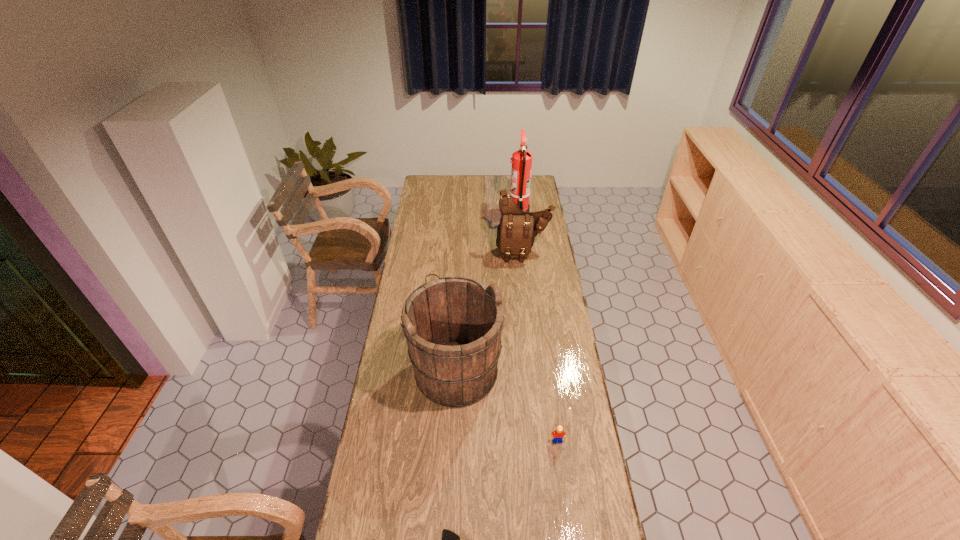
I want to click on vacant space at the right edge of the desktop, so click(539, 347).

Locate an element on the screen. The width and height of the screenshot is (960, 540). vacant region at the far right corner of the desktop is located at coordinates (541, 191).

Find the location of `vacant space that is in between the fourth farthest object and the second farthest object`. vacant space that is in between the fourth farthest object and the second farthest object is located at coordinates (540, 347).

You are a GUI agent. You are given a task and a screenshot of the screen. Output one action in this format:
    pyautogui.click(x=<x>, y=<y>)
    Task: Click on the unoccupied area between the fire extinguisher and the second shortest object
    
    Given the screenshot: What is the action you would take?
    pyautogui.click(x=538, y=327)

Identify the location of vacant area between the third farthest object and the second nearest object. (507, 406).

Identify which object is located as the nearest to the shoulder bag. Please provide its 2D coordinates. Your answer should be formatted as a tuple, i.e. [(x, y)], where the tuple contains the x and y coordinates of a point satisfying the conditions above.

[(521, 161)]

I want to click on object that is the closest to the second tallest object, so click(559, 434).